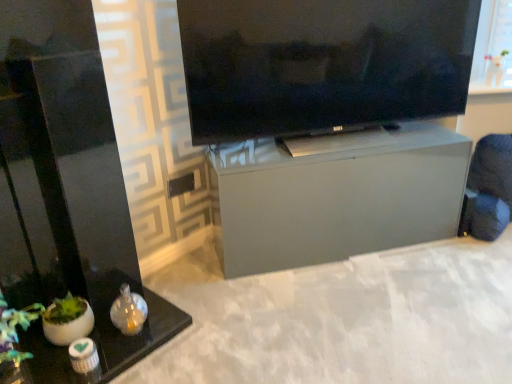
Question: Is satin gray cabinet at center, the second furniture from the front, inside the boundaries of black glass table at lower left, marked as the 2th furniture in a back-to-front arrangement, or outside?

Choices:
 (A) inside
 (B) outside

Answer: (B)

Question: Considering the positions of satin gray cabinet at center, the second furniture from the front, and black glass table at lower left, marked as the 2th furniture in a back-to-front arrangement, in the image, is satin gray cabinet at center, the second furniture from the front, wider or thinner than black glass table at lower left, marked as the 2th furniture in a back-to-front arrangement,?

Choices:
 (A) wide
 (B) thin

Answer: (B)

Question: Which of these objects is positioned closest to the matte black tv at upper center?

Choices:
 (A) satin gray cabinet at center, the 1th furniture when ordered from back to front
 (B) black glass table at lower left, the 2th furniture when ordered from right to left

Answer: (A)

Question: Which is nearer to the black glass table at lower left, acting as the first furniture starting from the left?

Choices:
 (A) satin gray cabinet at center, the second furniture from the front
 (B) matte black tv at upper center

Answer: (A)